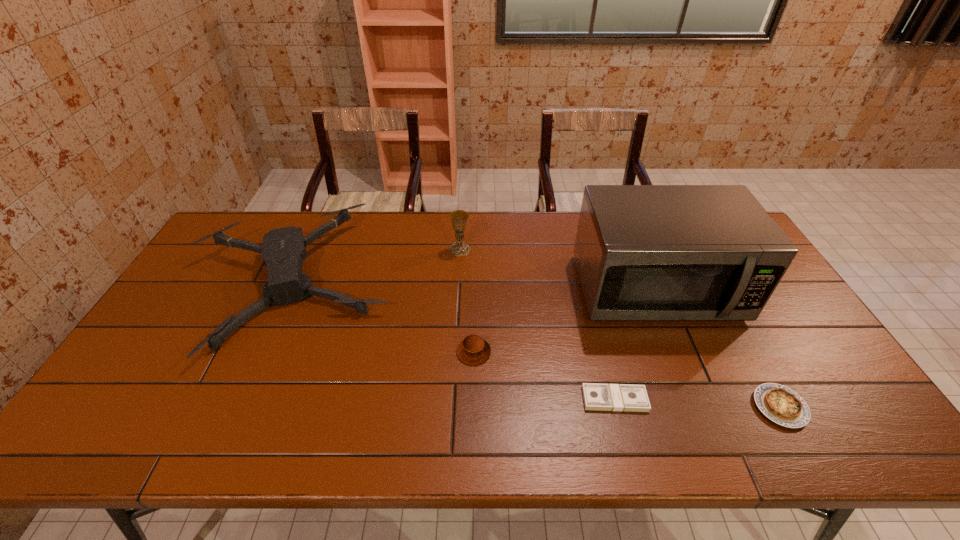
Identify the location of object at the near right corner. (779, 403).

This screenshot has height=540, width=960. Identify the location of vacant area at the far edge of the desktop. (432, 231).

Find the location of a particular element. This screenshot has height=540, width=960. vacant area at the near edge of the desktop is located at coordinates (243, 423).

Locate an element on the screen. blank space at the left edge of the desktop is located at coordinates coord(182,300).

Where is `free space that is in between the dollar and the chalice`? This screenshot has height=540, width=960. free space that is in between the dollar and the chalice is located at coordinates (538, 325).

The width and height of the screenshot is (960, 540). What are the coordinates of `vacant space in between the muffin and the third tallest object` in the screenshot? It's located at (383, 318).

Find the location of a particular element. This screenshot has width=960, height=540. vacant area between the shortest object and the tallest object is located at coordinates (636, 344).

At what (x,y) coordinates should I click in order to perform the action: click on vacant region between the muffin and the shortest object. Please return your answer as a coordinate pair (x, y). Looking at the image, I should click on [544, 375].

At what (x,y) coordinates should I click in order to perform the action: click on vacant area that lies between the second shortest object and the fifth shortest object. Please return your answer as a coordinate pair (x, y). This screenshot has height=540, width=960. Looking at the image, I should click on (620, 328).

Identify the location of free space that is in between the fifth tallest object and the leftmost object. (537, 346).